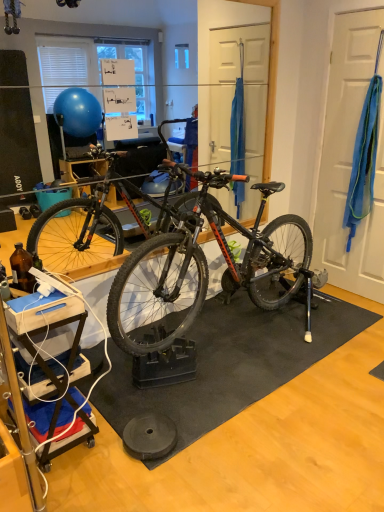
Question: Is black rubber mat at center bigger or smaller than blue fabric at right?

Choices:
 (A) big
 (B) small

Answer: (A)

Question: From the image's perspective, relative to blue fabric at right, is black rubber mat at center above or below?

Choices:
 (A) below
 (B) above

Answer: (A)

Question: Is black rubber mat at center situated inside blue fabric at right or outside?

Choices:
 (A) inside
 (B) outside

Answer: (B)

Question: Considering the positions of blue fabric at right and black rubber mat at center in the image, is blue fabric at right taller or shorter than black rubber mat at center?

Choices:
 (A) tall
 (B) short

Answer: (A)

Question: Considering the positions of blue fabric at right and black rubber mat at center in the image, is blue fabric at right wider or thinner than black rubber mat at center?

Choices:
 (A) wide
 (B) thin

Answer: (B)

Question: Would you say blue fabric at right is to the left or to the right of black rubber mat at center in the picture?

Choices:
 (A) left
 (B) right

Answer: (B)

Question: Considering their positions, is blue fabric at right located in front of or behind black rubber mat at center?

Choices:
 (A) front
 (B) behind

Answer: (B)